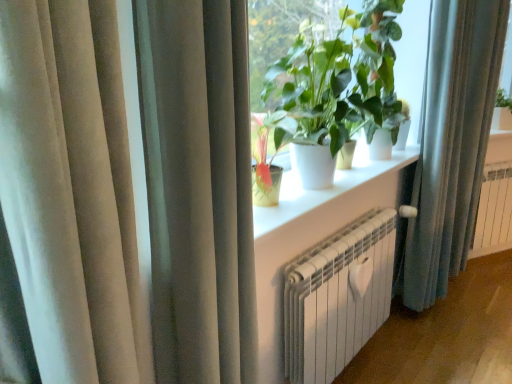
Question: From a real-world perspective, is green matte plant at upper center located beneath white metallic radiator at lower center?

Choices:
 (A) no
 (B) yes

Answer: (A)

Question: From the image's perspective, is green matte plant at upper center above white metallic radiator at lower center?

Choices:
 (A) no
 (B) yes

Answer: (B)

Question: Would you say green matte plant at upper center is outside white metallic radiator at lower center?

Choices:
 (A) yes
 (B) no

Answer: (A)

Question: Is green matte plant at upper center oriented away from white metallic radiator at lower center?

Choices:
 (A) yes
 (B) no

Answer: (B)

Question: Is green matte plant at upper center taller than white metallic radiator at lower center?

Choices:
 (A) no
 (B) yes

Answer: (B)

Question: From the image's perspective, is satin beige curtain at left, the first curtain when ordered from front to back, located above or below white metallic radiator at right?

Choices:
 (A) above
 (B) below

Answer: (B)

Question: Looking at their shapes, would you say satin beige curtain at left, the first curtain when ordered from front to back, is wider or thinner than white metallic radiator at right?

Choices:
 (A) wide
 (B) thin

Answer: (A)

Question: Is satin beige curtain at left, the second curtain positioned from the right, in front of or behind white metallic radiator at right in the image?

Choices:
 (A) front
 (B) behind

Answer: (A)

Question: Considering the relative positions of satin beige curtain at left, the first curtain when ordered from front to back, and white metallic radiator at right in the image provided, is satin beige curtain at left, the first curtain when ordered from front to back, to the left or to the right of white metallic radiator at right?

Choices:
 (A) right
 (B) left

Answer: (B)

Question: From the image's perspective, is white matte window sill at center above or below white metallic radiator at lower center?

Choices:
 (A) below
 (B) above

Answer: (B)

Question: Does point (291, 198) appear closer or farther from the camera than point (373, 271)?

Choices:
 (A) farther
 (B) closer

Answer: (B)

Question: Relative to white metallic radiator at lower center, is white matte window sill at center in front or behind?

Choices:
 (A) front
 (B) behind

Answer: (A)

Question: From a real-world perspective, is white matte window sill at center physically located above or below white metallic radiator at lower center?

Choices:
 (A) below
 (B) above

Answer: (B)

Question: From a real-world perspective, is satin beige curtain at left, the first curtain when ordered from front to back, physically located above or below white matte window sill at center?

Choices:
 (A) below
 (B) above

Answer: (B)

Question: Is satin beige curtain at left, the 1th curtain when ordered from left to right, wider or thinner than white matte window sill at center?

Choices:
 (A) wide
 (B) thin

Answer: (B)